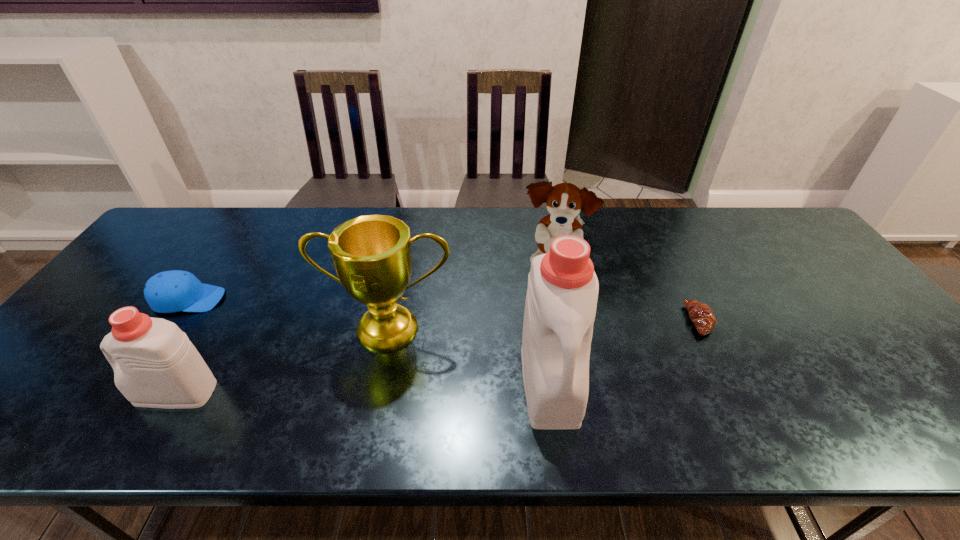
Identify the location of vacant area situated on the handle side of the left detergent. The image size is (960, 540). (61, 393).

Identify the location of vacant space located 0.350m on the right of the crescent roll. This screenshot has width=960, height=540. (848, 320).

What are the coordinates of `vacant area located on the shiny surface of the award` in the screenshot? It's located at (378, 387).

Image resolution: width=960 pixels, height=540 pixels. What are the coordinates of `vacant area located on the front-facing side of the cap` in the screenshot? It's located at (371, 300).

Where is `vacant area situated 0.190m on the face of the puppy`? vacant area situated 0.190m on the face of the puppy is located at coordinates (567, 339).

At what (x,y) coordinates should I click in order to perform the action: click on object that is at the far edge. Please return your answer as a coordinate pair (x, y). Image resolution: width=960 pixels, height=540 pixels. Looking at the image, I should click on (564, 201).

You are a GUI agent. You are given a task and a screenshot of the screen. Output one action in this format:
    pyautogui.click(x=<x>, y=<y>)
    Task: Click on the object at the left edge
    
    Given the screenshot: What is the action you would take?
    pyautogui.click(x=172, y=291)

I want to click on vacant area at the far edge of the desktop, so click(269, 223).

This screenshot has width=960, height=540. In the image, there is a desktop. Find the location of `vacant space at the near edge`. vacant space at the near edge is located at coordinates (642, 380).

Find the location of a particular element. vacant space at the right edge is located at coordinates (804, 259).